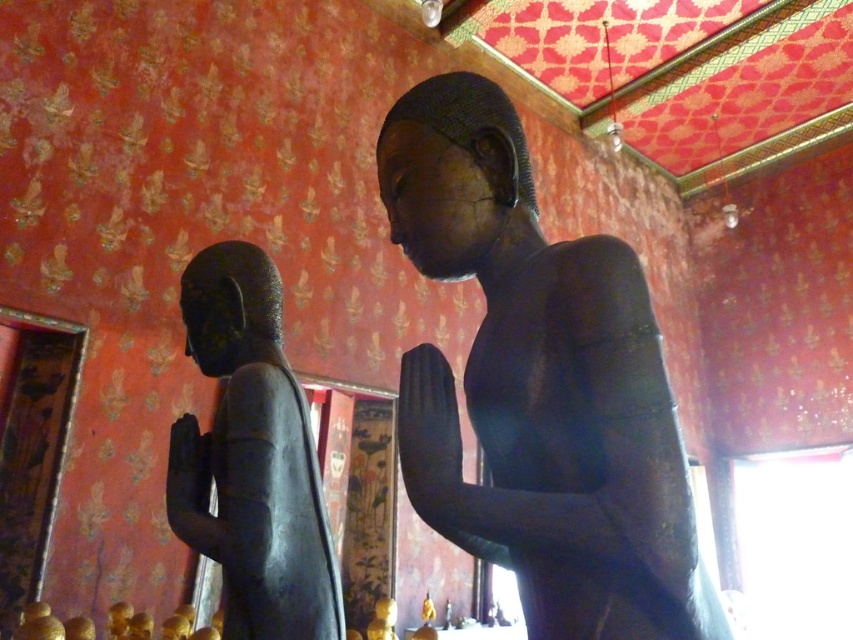
Does point (631, 618) come in front of point (235, 280)?

Yes.

Is matte black statue at center thinner than matte black statue at left?

No, matte black statue at center is not thinner than matte black statue at left.

This screenshot has width=853, height=640. In order to click on matte black statue at center in this screenshot , I will do `click(540, 387)`.